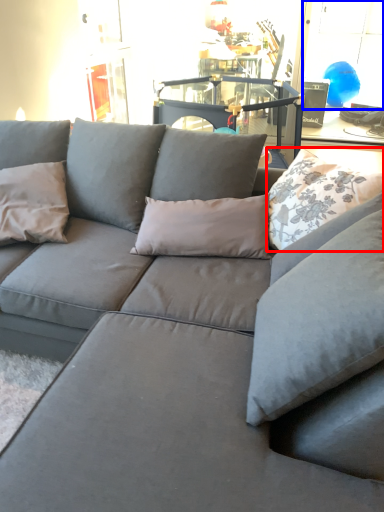
Question: Which point is further to the camera, pillow (highlighted by a red box) or window (highlighted by a blue box)?

Choices:
 (A) pillow
 (B) window

Answer: (B)